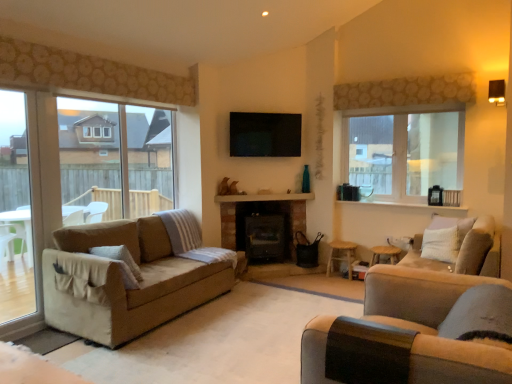
The height and width of the screenshot is (384, 512). In order to click on light beige fabric couch at right, the 1th studio couch from the back in this screenshot , I will do `click(464, 250)`.

Looking at this image, what is the approximate height of clear glass window at left, which ranks as the first window in left-to-right order?

clear glass window at left, which ranks as the first window in left-to-right order, is 6.84 feet tall.

What do you see at coordinates (40, 195) in the screenshot? The height and width of the screenshot is (384, 512). I see `clear glass window at left, which ranks as the first window in left-to-right order` at bounding box center [40, 195].

Image resolution: width=512 pixels, height=384 pixels. I want to click on clear glass window at upper right, the second window in the left-to-right sequence, so click(x=405, y=151).

What is the approximate width of clear glass window at upper right, the second window in the left-to-right sequence?

It is 9.55 inches.

In order to click on brick fireplace at center in this screenshot , I will do click(x=264, y=197).

At what (x,y) coordinates should I click in order to perform the action: click on black matte fireplace at center. Please return your answer as a coordinate pair (x, y). Looking at the image, I should click on (264, 230).

You are a GUI agent. You are given a task and a screenshot of the screen. Output one action in this format:
    pyautogui.click(x=<x>, y=<y>)
    Task: Click on the wooden stool at center, the first stool in the left-to-right sequence
    Image resolution: width=512 pixels, height=384 pixels.
    Given the screenshot: What is the action you would take?
    pyautogui.click(x=341, y=255)

Between wooden stool at lower right, which is the first stool from right to left, and clear glass window at upper right, the 1th window in the right-to-left sequence, which one appears on the left side from the viewer's perspective?

wooden stool at lower right, which is the first stool from right to left, is more to the left.

Is wooden stool at lower right, placed as the 2th stool when sorted from left to right, outside of clear glass window at upper right, the second window in the left-to-right sequence?

That's correct, wooden stool at lower right, placed as the 2th stool when sorted from left to right, is outside of clear glass window at upper right, the second window in the left-to-right sequence.

In terms of height, does wooden stool at lower right, placed as the 2th stool when sorted from left to right, look taller or shorter compared to clear glass window at upper right, the 1th window in the right-to-left sequence?

wooden stool at lower right, placed as the 2th stool when sorted from left to right, is shorter than clear glass window at upper right, the 1th window in the right-to-left sequence.

Is clear glass window at upper right, the second window in the left-to-right sequence, at the back of wooden stool at lower right, which is the first stool from right to left?

No, wooden stool at lower right, which is the first stool from right to left, is not facing the opposite direction of clear glass window at upper right, the second window in the left-to-right sequence.

Which of these two, beige fabric couch at right or wooden stool at center, the second stool in the right-to-left sequence, is thinner?

wooden stool at center, the second stool in the right-to-left sequence, is thinner.

Is beige fabric couch at right far from wooden stool at center, the first stool in the left-to-right sequence?

Yes, beige fabric couch at right and wooden stool at center, the first stool in the left-to-right sequence, are located far from each other.

From the picture: Considering the sizes of objects beige fabric couch at right and wooden stool at center, the first stool in the left-to-right sequence, in the image provided, who is taller, beige fabric couch at right or wooden stool at center, the first stool in the left-to-right sequence,?

beige fabric couch at right.

What's the angular difference between beige fabric couch at right and wooden stool at center, the second stool in the right-to-left sequence,'s facing directions?

The angular difference between beige fabric couch at right and wooden stool at center, the second stool in the right-to-left sequence, is 89.6 degrees.

From a real-world perspective, does beige fabric couch at right stand above light beige fabric couch at right, the 1th studio couch from the back?

No, from a real-world perspective, beige fabric couch at right is not above light beige fabric couch at right, the 1th studio couch from the back.

Would you say beige fabric couch at right is outside light beige fabric couch at right, the 1th studio couch from the back?

Yes, beige fabric couch at right is not within light beige fabric couch at right, the 1th studio couch from the back.

Can you tell me how much beige fabric couch at right and light beige fabric couch at right, the 2th studio couch when ordered from left to right, differ in facing direction?

The angle between the facing direction of beige fabric couch at right and the facing direction of light beige fabric couch at right, the 2th studio couch when ordered from left to right, is 169 degrees.

From the image's perspective, between beige fabric couch at right and light beige fabric couch at right, placed as the 2th studio couch when sorted from front to back, which one is located above?

From the image's view, light beige fabric couch at right, placed as the 2th studio couch when sorted from front to back, is above.

How many degrees apart are the facing directions of light beige fabric couch at right, the 1th studio couch from the back, and beige fabric couch at right?

The angle between the facing direction of light beige fabric couch at right, the 1th studio couch from the back, and the facing direction of beige fabric couch at right is 169 degrees.

In the scene shown: Is light beige fabric couch at right, the 1th studio couch from the back, at the right side of beige fabric couch at right?

Incorrect, light beige fabric couch at right, the 1th studio couch from the back, is not on the right side of beige fabric couch at right.

What are the coordinates of `studio couch above the beige fabric couch at right (from a real-world perspective)` in the screenshot? It's located at (464, 250).

Looking at this image, between light beige fabric couch at right, the 1th studio couch from the back, and beige fabric couch at right, which one is positioned in front?

beige fabric couch at right is more forward.

Considering the relative sizes of wooden stool at lower right, placed as the 2th stool when sorted from left to right, and clear glass door at left in the image provided, is wooden stool at lower right, placed as the 2th stool when sorted from left to right, smaller than clear glass door at left?

Yes, wooden stool at lower right, placed as the 2th stool when sorted from left to right, is smaller than clear glass door at left.

Locate an element on the screen. The height and width of the screenshot is (384, 512). window frame above the wooden stool at lower right, placed as the 2th stool when sorted from left to right (from the image's perspective) is located at coordinates (15, 212).

From the image's perspective, which one is positioned lower, wooden stool at lower right, which is the first stool from right to left, or clear glass door at left?

wooden stool at lower right, which is the first stool from right to left, from the image's perspective.

Based on the photo, is wooden stool at lower right, placed as the 2th stool when sorted from left to right, far away from clear glass door at left?

Yes, wooden stool at lower right, placed as the 2th stool when sorted from left to right, and clear glass door at left are located far from each other.

Is point (33, 190) closer or farther from the camera than point (379, 246)?

Point (33, 190) is positioned closer to the camera compared to point (379, 246).

Is clear glass window at left, which ranks as the first window in left-to-right order, to the left or to the right of wooden stool at lower right, which is the first stool from right to left, in the image?

clear glass window at left, which ranks as the first window in left-to-right order, is to the left of wooden stool at lower right, which is the first stool from right to left.

Does clear glass window at left, which is counted as the second window, starting from the right, lie in front of wooden stool at lower right, which is the first stool from right to left?

Yes.

From the image's perspective, relative to wooden stool at lower right, which is the first stool from right to left, is clear glass window at left, which ranks as the first window in left-to-right order, above or below?

Clearly, from the image's perspective, clear glass window at left, which ranks as the first window in left-to-right order, is above wooden stool at lower right, which is the first stool from right to left.

Relative to clear glass window at left, which ranks as the first window in left-to-right order, is beige fabric couch at lower right, marked as the 2th studio couch in a right-to-left arrangement, in front or behind?

In the image, beige fabric couch at lower right, marked as the 2th studio couch in a right-to-left arrangement, appears in front of clear glass window at left, which ranks as the first window in left-to-right order.

Is beige fabric couch at lower right, marked as the 2th studio couch in a right-to-left arrangement, positioned with its back to clear glass window at left, which ranks as the first window in left-to-right order?

beige fabric couch at lower right, marked as the 2th studio couch in a right-to-left arrangement, does not have its back to clear glass window at left, which ranks as the first window in left-to-right order.

From a real-world perspective, is beige fabric couch at lower right, the first studio couch when ordered from left to right, physically located above or below clear glass window at left, which is counted as the second window, starting from the right?

→ beige fabric couch at lower right, the first studio couch when ordered from left to right, is below clear glass window at left, which is counted as the second window, starting from the right.

The image size is (512, 384). I want to click on the 1st stool to the left of the clear glass window at upper right, the 1th window in the right-to-left sequence, starting your count from the anchor, so click(384, 253).

Find the location of a particular element. the 2nd stool below the beige fabric couch at right (from the image's perspective) is located at coordinates (341, 255).

Based on the photo, from the image, which object appears to be farther from beige fabric couch at right, beige fabric couch at lower right, marked as the 2th studio couch in a right-to-left arrangement, or wooden stool at center, the second stool in the right-to-left sequence?

The object further to beige fabric couch at right is wooden stool at center, the second stool in the right-to-left sequence.

From the image, which object appears to be nearer to brick fireplace at center, wooden stool at lower right, which is the first stool from right to left, or clear glass window at upper right, the second window in the left-to-right sequence?

The object closer to brick fireplace at center is clear glass window at upper right, the second window in the left-to-right sequence.

Based on their spatial positions, is black matte fireplace at center or brick fireplace at center further from wooden stool at lower right, which is the first stool from right to left?

black matte fireplace at center lies further to wooden stool at lower right, which is the first stool from right to left, than the other object.

Based on their spatial positions, is light beige fabric couch at right, the 2th studio couch when ordered from left to right, or beige fabric couch at right closer to clear glass window at upper right, the 1th window in the right-to-left sequence?

light beige fabric couch at right, the 2th studio couch when ordered from left to right, is closer to clear glass window at upper right, the 1th window in the right-to-left sequence.

Which object lies nearer to the anchor point black matte fireplace at center, brick fireplace at center or light beige fabric couch at right, arranged as the first studio couch when viewed from the right?

Based on the image, brick fireplace at center appears to be nearer to black matte fireplace at center.

When comparing their distances from beige fabric couch at right, does wooden stool at center, the second stool in the right-to-left sequence, or clear glass window at upper right, the second window in the left-to-right sequence, seem further?

Among the two, clear glass window at upper right, the second window in the left-to-right sequence, is located further to beige fabric couch at right.

Estimate the real-world distances between objects in this image. Which object is closer to wooden stool at center, the first stool in the left-to-right sequence, light beige fabric couch at right, the 1th studio couch from the back, or clear glass window at left, which ranks as the first window in left-to-right order?

light beige fabric couch at right, the 1th studio couch from the back, is positioned closer to the anchor wooden stool at center, the first stool in the left-to-right sequence.

Considering their positions, is brick fireplace at center positioned closer to beige fabric couch at lower right, marked as the 2th studio couch in a right-to-left arrangement, than wooden stool at lower right, which is the first stool from right to left?

The object closer to beige fabric couch at lower right, marked as the 2th studio couch in a right-to-left arrangement, is wooden stool at lower right, which is the first stool from right to left.

Locate an element on the screen. mantle between beige fabric couch at lower right, the first studio couch when ordered from left to right, and black matte fireplace at center in the front-back direction is located at coordinates (264, 197).

Where is `studio couch between clear glass window at upper right, the 1th window in the right-to-left sequence, and beige fabric couch at right in the up-down direction`? The height and width of the screenshot is (384, 512). studio couch between clear glass window at upper right, the 1th window in the right-to-left sequence, and beige fabric couch at right in the up-down direction is located at coordinates (464, 250).

You are a GUI agent. You are given a task and a screenshot of the screen. Output one action in this format:
    pyautogui.click(x=<x>, y=<y>)
    Task: Click on the fireplace between clear glass window at left, which ranks as the first window in left-to-right order, and beige fabric couch at right, in the horizontal direction
    This screenshot has width=512, height=384.
    Given the screenshot: What is the action you would take?
    pyautogui.click(x=264, y=230)

You are a GUI agent. You are given a task and a screenshot of the screen. Output one action in this format:
    pyautogui.click(x=<x>, y=<y>)
    Task: Click on the fireplace between clear glass door at left and clear glass window at upper right, the second window in the left-to-right sequence
    This screenshot has height=384, width=512.
    Given the screenshot: What is the action you would take?
    pyautogui.click(x=264, y=230)